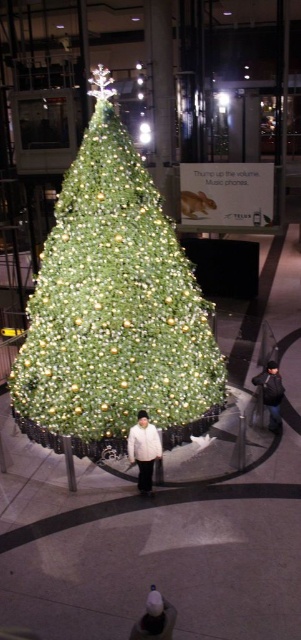
Question: Observing the image, what is the correct spatial positioning of green matte christmas tree at center in reference to white matte jacket at center?

Choices:
 (A) right
 (B) left

Answer: (B)

Question: Which of the following is the farthest from the observer?

Choices:
 (A) white knit cap at center
 (B) green matte christmas tree at center
 (C) dark gray knit hat at lower right
 (D) white matte jacket at center

Answer: (C)

Question: Which point is farther from the camera taking this photo?

Choices:
 (A) (163, 609)
 (B) (55, 237)
 (C) (152, 452)

Answer: (B)

Question: Is white matte jacket at center bigger than white knit cap at center?

Choices:
 (A) no
 (B) yes

Answer: (B)

Question: Estimate the real-world distances between objects in this image. Which object is farther from the white knit cap at center?

Choices:
 (A) white matte jacket at center
 (B) dark gray knit hat at lower right
 (C) green matte christmas tree at center

Answer: (B)

Question: Can you confirm if green matte christmas tree at center is thinner than dark gray knit hat at lower right?

Choices:
 (A) yes
 (B) no

Answer: (B)